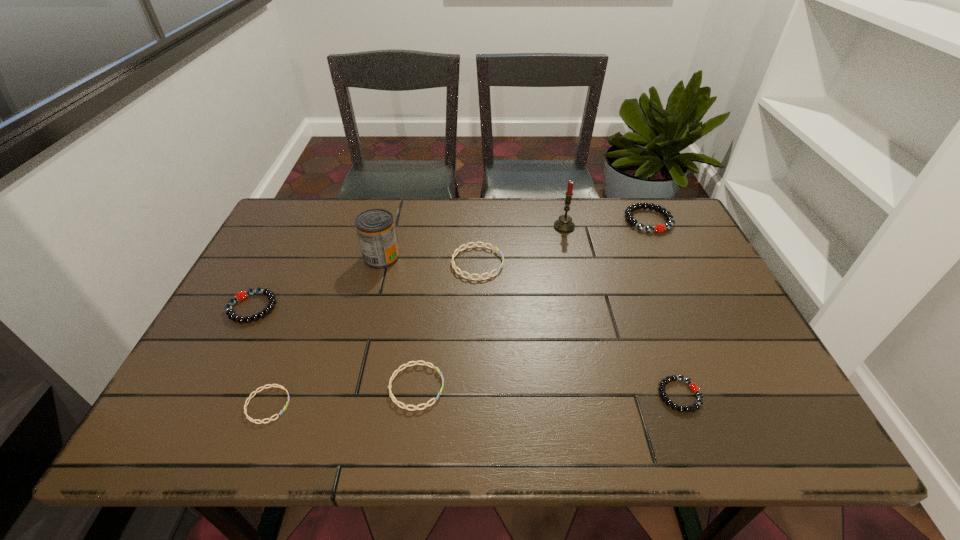
Where is `vacant space at the far left corner of the desktop`? The height and width of the screenshot is (540, 960). vacant space at the far left corner of the desktop is located at coordinates (312, 202).

Where is `vacant space at the far right corner of the desktop`? This screenshot has width=960, height=540. vacant space at the far right corner of the desktop is located at coordinates (644, 202).

Identify the location of free space at the near right corner. This screenshot has width=960, height=540. (780, 418).

Identify the location of vacant point located between the tallest bracelet and the shortest object. The width and height of the screenshot is (960, 540). (458, 313).

At what (x,y) coordinates should I click in order to perform the action: click on free space between the third object from right to left and the sixth shortest object. Please return your answer as a coordinate pair (x, y). The height and width of the screenshot is (540, 960). Looking at the image, I should click on (606, 224).

Locate an element on the screen. This screenshot has width=960, height=540. free spot between the red can and the second biggest blue bracelet is located at coordinates (399, 322).

In order to click on empty space that is in between the farthest black bracelet and the farthest blue bracelet in this screenshot , I will do (563, 241).

Locate an element on the screen. This screenshot has height=540, width=960. vacant area that lies between the shortest bracelet and the biggest blue bracelet is located at coordinates (372, 334).

Find the location of a particular element. The image size is (960, 540). free space between the sixth object from left to right and the sixth object from right to left is located at coordinates (473, 242).

Locate an element on the screen. The width and height of the screenshot is (960, 540). vacant area between the second biggest blue bracelet and the leftmost blue bracelet is located at coordinates (342, 396).